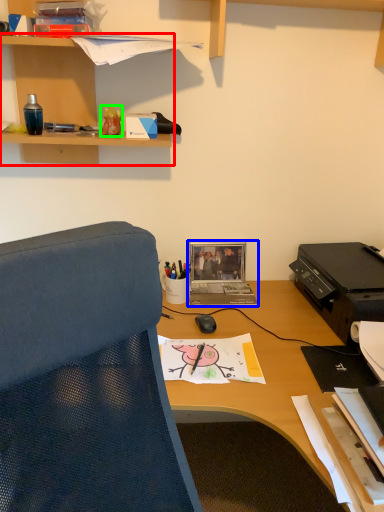
Question: Estimate the real-world distances between objects in this image. Which object is farther from shelf (highlighted by a red box), laptop (highlighted by a blue box) or stationery (highlighted by a green box)?

Choices:
 (A) laptop
 (B) stationery

Answer: (A)